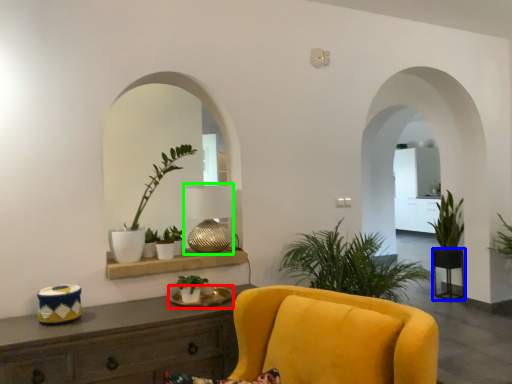
Question: Which is nearer to the round table (highlighted by a red box)? round table (highlighted by a blue box) or lamp (highlighted by a green box).

Choices:
 (A) round table
 (B) lamp

Answer: (B)